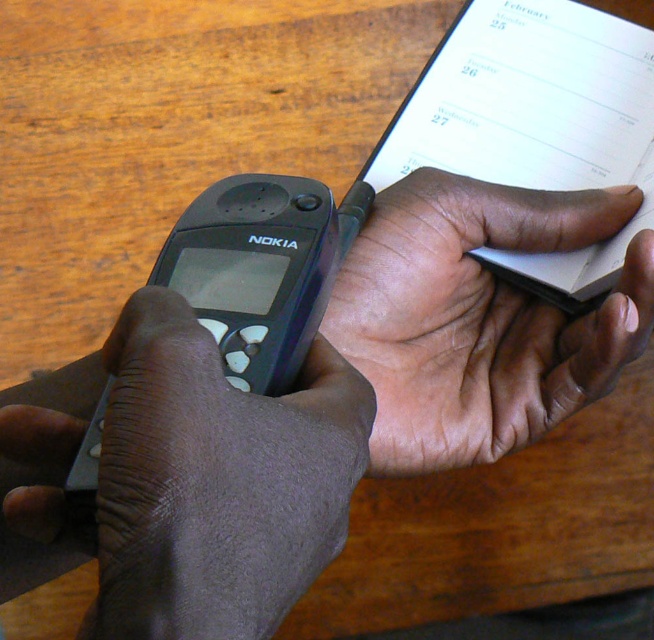
Who is more forward, (x=190, y=424) or (x=581, y=177)?

Point (x=190, y=424) is more forward.

Who is shorter, matte black phone at center or white paper at upper right?

Standing shorter between the two is matte black phone at center.

Between point (409, 376) and point (523, 56), which one is positioned in front?

Point (409, 376) is in front.

Locate an element on the screen. The width and height of the screenshot is (654, 640). matte black phone at center is located at coordinates (341, 403).

Does matte black phone at center have a lesser width compared to smooth skin hand at center?

No.

Measure the distance between matte black phone at center and camera.

A distance of 28.91 centimeters exists between matte black phone at center and camera.

You are a GUI agent. You are given a task and a screenshot of the screen. Output one action in this format:
    pyautogui.click(x=<x>, y=<y>)
    Task: Click on the matte black phone at center
    This screenshot has height=640, width=654.
    Given the screenshot: What is the action you would take?
    pyautogui.click(x=341, y=403)

What are the coordinates of `matte black phone at center` in the screenshot? It's located at (341, 403).

Is matte black phone at center below matte plastic phone at lower left?

Actually, matte black phone at center is above matte plastic phone at lower left.

Does matte black phone at center have a smaller size compared to matte plastic phone at lower left?

No, matte black phone at center is not smaller than matte plastic phone at lower left.

Does point (470, 221) come in front of point (250, 612)?

That is False.

You are a GUI agent. You are given a task and a screenshot of the screen. Output one action in this format:
    pyautogui.click(x=<x>, y=<y>)
    Task: Click on the matte black phone at center
    This screenshot has width=654, height=640.
    Given the screenshot: What is the action you would take?
    pyautogui.click(x=341, y=403)